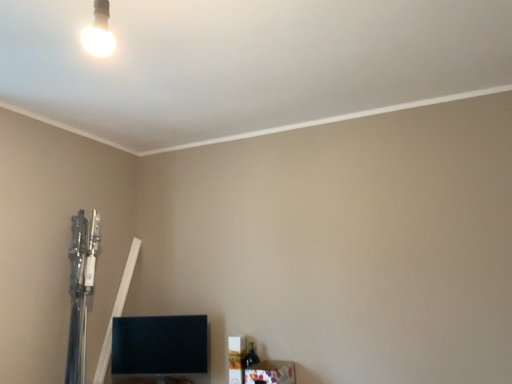
Question: Would you say white glossy bulb at upper left is to the left or to the right of wooden frame at lower right, which is the 1th furniture from right to left, in the picture?

Choices:
 (A) left
 (B) right

Answer: (A)

Question: Based on their sizes in the image, would you say white glossy bulb at upper left is bigger or smaller than wooden frame at lower right, which is the 1th furniture from right to left?

Choices:
 (A) small
 (B) big

Answer: (A)

Question: Which object is positioned closest to the white glossy bulb at upper left?

Choices:
 (A) black glossy tv at lower left, the 2th furniture viewed from the right
 (B) wooden frame at lower right, which is counted as the 2th furniture, starting from the back

Answer: (A)

Question: Estimate the real-world distances between objects in this image. Which object is farther from the black glossy tv at lower left, the 2th furniture viewed from the right?

Choices:
 (A) white glossy bulb at upper left
 (B) wooden frame at lower right, which is the 1th furniture from right to left

Answer: (A)